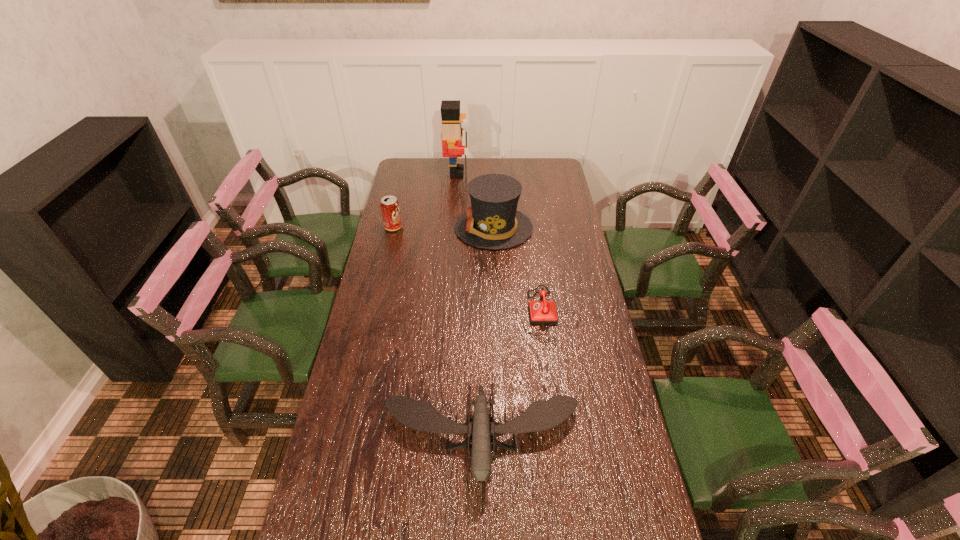
Find the location of `drone at the left edge`. drone at the left edge is located at coordinates (541, 415).

Find the location of `drone positioned at the right edge`. drone positioned at the right edge is located at coordinates (541, 415).

This screenshot has height=540, width=960. In order to click on telephone situated at the right edge in this screenshot , I will do `click(541, 312)`.

Image resolution: width=960 pixels, height=540 pixels. What are the coordinates of `vacant space at the left edge of the desktop` in the screenshot? It's located at (316, 531).

In the image, there is a desktop. At what (x,y) coordinates should I click in order to perform the action: click on vacant space at the right edge. Please return your answer as a coordinate pair (x, y). Looking at the image, I should click on (591, 320).

Locate an element on the screen. This screenshot has width=960, height=540. free spot between the shortest object and the drone is located at coordinates (517, 375).

Locate an element on the screen. The image size is (960, 540). empty location between the telephone and the leftmost object is located at coordinates (473, 271).

The height and width of the screenshot is (540, 960). I want to click on free area in between the dress hat and the drone, so click(x=488, y=333).

The height and width of the screenshot is (540, 960). Find the location of `vacant area that lies between the soda can and the drone`. vacant area that lies between the soda can and the drone is located at coordinates (437, 332).

You are a GUI agent. You are given a task and a screenshot of the screen. Output one action in this format:
    pyautogui.click(x=<x>, y=<y>)
    Task: Click on the free space between the dress hat and the telephone
    
    Given the screenshot: What is the action you would take?
    pyautogui.click(x=523, y=271)